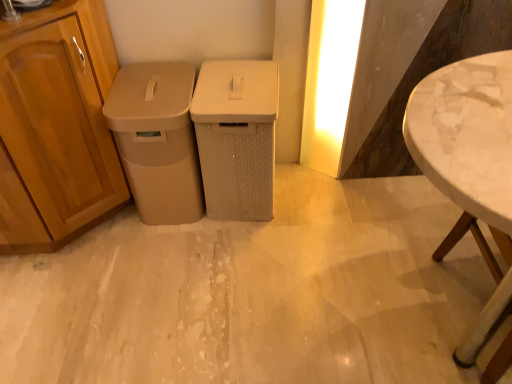
Identify the location of empty space that is ontop of beige matte trash can at left, positioned as the first waste container in left-to-right order (from a real-world perspective). (147, 90).